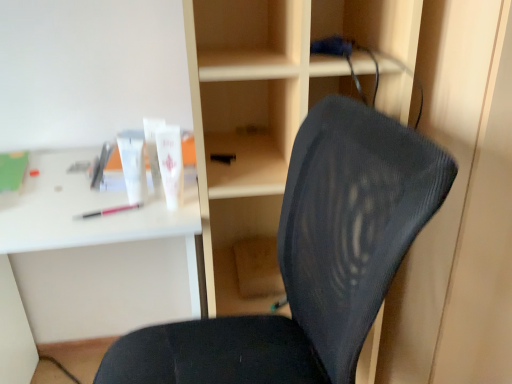
The height and width of the screenshot is (384, 512). I want to click on vacant space positioned to the left of pink plastic pen at left, so click(x=65, y=211).